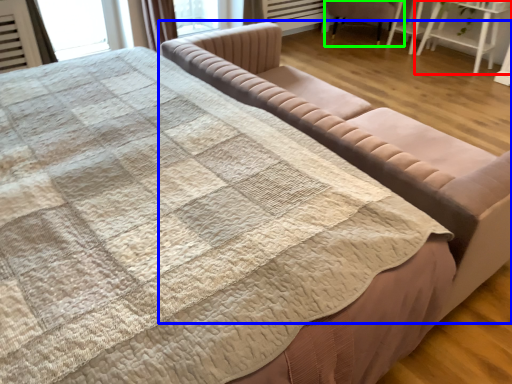
Question: Considering the real-world distances, which object is closest to table (highlighted by a red box)? studio couch (highlighted by a blue box) or chair (highlighted by a green box).

Choices:
 (A) studio couch
 (B) chair

Answer: (B)